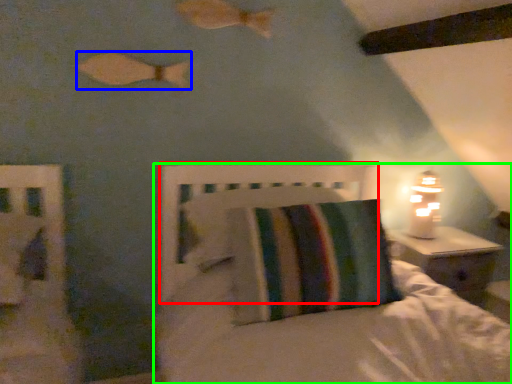
Question: Which is nearer to the headboard (highlighted by a red box)? fish (highlighted by a blue box) or bed (highlighted by a green box).

Choices:
 (A) fish
 (B) bed

Answer: (B)